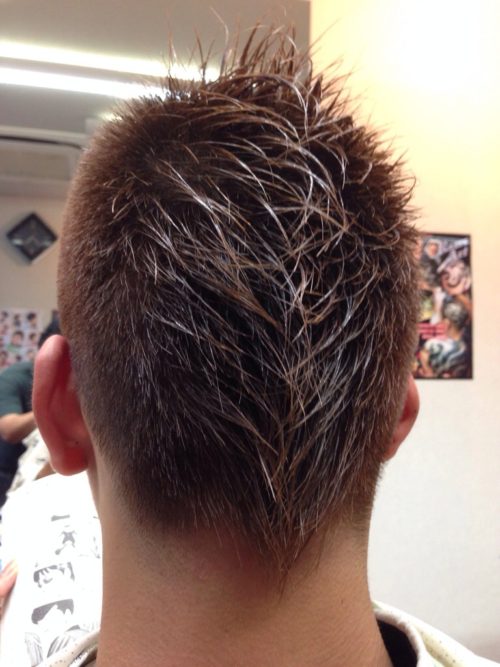
Identify the location of wall. tap(480, 551).